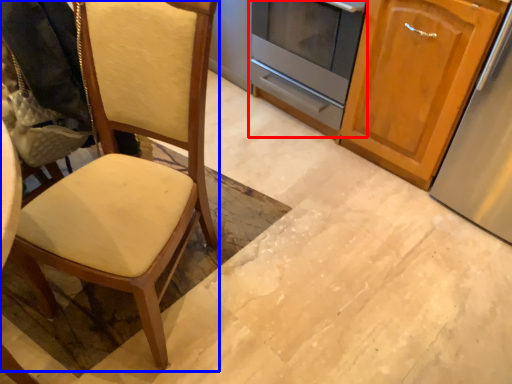
Question: Which object appears farthest to the camera in this image, oven (highlighted by a red box) or chair (highlighted by a blue box)?

Choices:
 (A) oven
 (B) chair

Answer: (A)